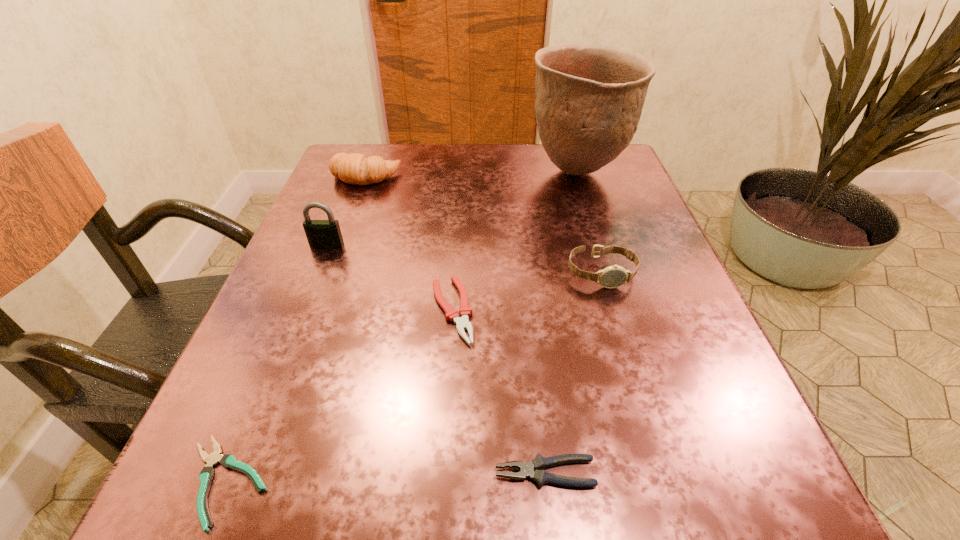
Find the location of a particular element. The height and width of the screenshot is (540, 960). pottery is located at coordinates (589, 98).

You are a GUI agent. You are given a task and a screenshot of the screen. Output one action in this format:
    pyautogui.click(x=<x>, y=<y>)
    Task: Click on the padlock
    This screenshot has height=540, width=960.
    Given the screenshot: What is the action you would take?
    pyautogui.click(x=321, y=234)

What are the coordinates of `the second tallest object` in the screenshot? It's located at (321, 234).

At what (x,y) coordinates should I click in order to perform the action: click on crescent roll. Please return your answer as a coordinate pair (x, y). Looking at the image, I should click on (355, 168).

Locate an element on the screen. The height and width of the screenshot is (540, 960). watch is located at coordinates [x=615, y=276].

Image resolution: width=960 pixels, height=540 pixels. In order to click on the rightmost pliers in this screenshot , I will do `click(538, 464)`.

This screenshot has height=540, width=960. In order to click on the second pliers from left to right in this screenshot , I will do `click(462, 323)`.

Where is `the fourth object from left to right`? The height and width of the screenshot is (540, 960). the fourth object from left to right is located at coordinates (462, 323).

Find the location of a particular element. the shortest pliers is located at coordinates (229, 461).

Where is `the shortest object`? the shortest object is located at coordinates point(229,461).